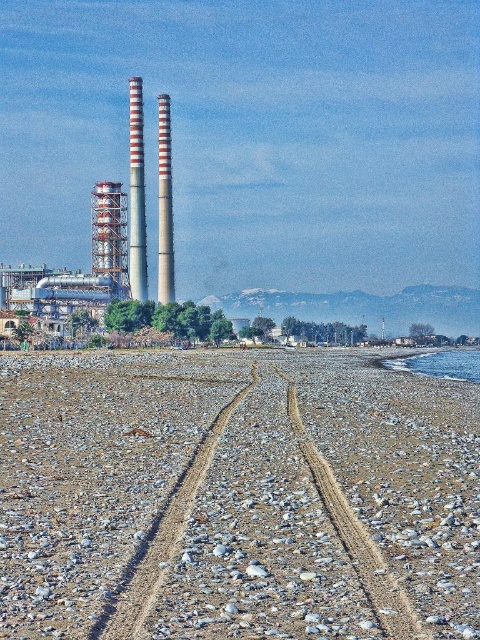
You are standing at the pebble beach looking towards the industrial structures. There are two points marked on the image. Which point, point (x=392, y=372) or point (x=162, y=291), is closer to you?

Point (x=392, y=372) is closer to you than point (x=162, y=291).

You are standing on the pebble beach and see two points marked in the image. The first point is at coordinate point (48, 422) and the second is at point (465, 369). Which point is nearer to you?

Point (48, 422) is closer to the viewer than point (465, 369).

You are standing at the edge of the pebble beach and notice a specific point marked at coordinates (236, 497). What type of terrain feature would you expect to find there?

At point (236, 497) lies smooth pebbles at center.